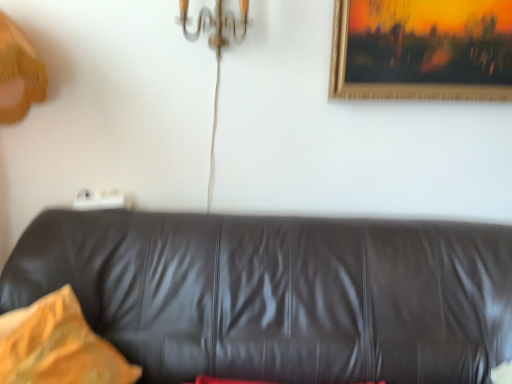
Question: Could yellow fabric pillow at left be considered to be inside black leather couch at center?

Choices:
 (A) yes
 (B) no

Answer: (A)

Question: Considering the relative sizes of black leather couch at center and yellow fabric pillow at left in the image provided, is black leather couch at center smaller than yellow fabric pillow at left?

Choices:
 (A) yes
 (B) no

Answer: (B)

Question: Can you confirm if black leather couch at center is positioned to the left of yellow fabric pillow at left?

Choices:
 (A) no
 (B) yes

Answer: (A)

Question: Is black leather couch at center not inside yellow fabric pillow at left?

Choices:
 (A) no
 (B) yes

Answer: (B)

Question: Does black leather couch at center have a greater height compared to yellow fabric pillow at left?

Choices:
 (A) yes
 (B) no

Answer: (A)

Question: Is black leather couch at center positioned before yellow fabric pillow at left?

Choices:
 (A) no
 (B) yes

Answer: (B)

Question: Is yellow fabric pillow at left behind gold-framed painting at upper right?

Choices:
 (A) yes
 (B) no

Answer: (B)

Question: Considering the relative sizes of yellow fabric pillow at left and gold-framed painting at upper right in the image provided, is yellow fabric pillow at left bigger than gold-framed painting at upper right?

Choices:
 (A) no
 (B) yes

Answer: (B)

Question: From the image's perspective, does yellow fabric pillow at left appear lower than gold-framed painting at upper right?

Choices:
 (A) no
 (B) yes

Answer: (B)

Question: From a real-world perspective, is yellow fabric pillow at left physically above gold-framed painting at upper right?

Choices:
 (A) no
 (B) yes

Answer: (A)

Question: Is yellow fabric pillow at left directly adjacent to gold-framed painting at upper right?

Choices:
 (A) yes
 (B) no

Answer: (B)

Question: Does yellow fabric pillow at left have a lesser width compared to gold-framed painting at upper right?

Choices:
 (A) no
 (B) yes

Answer: (A)

Question: Would you say black leather couch at center is part of yellow fabric pillow at left's contents?

Choices:
 (A) yes
 (B) no

Answer: (B)